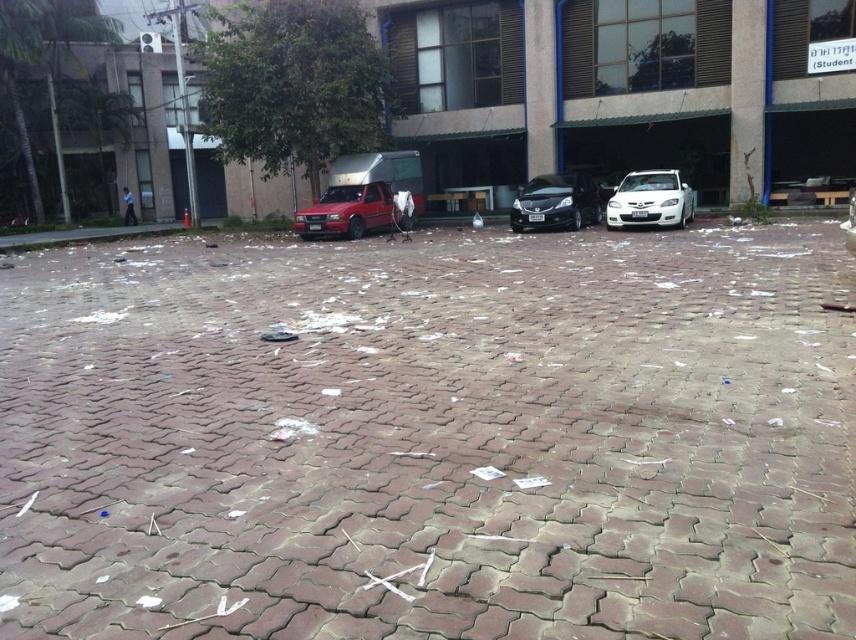
Can you confirm if brick pavement at center is positioned below matte red truck at center?

Indeed, brick pavement at center is positioned under matte red truck at center.

Between brick pavement at center and matte red truck at center, which one has less height?

With less height is matte red truck at center.

Where is `brick pavement at center`? brick pavement at center is located at coordinates (431, 438).

Is satin black car at center thinner than white glossy car at center?

In fact, satin black car at center might be wider than white glossy car at center.

Who is more forward, (x=577, y=220) or (x=669, y=177)?

Point (x=669, y=177)

Which is in front, point (515, 212) or point (639, 186)?

Point (639, 186)

I want to click on satin black car at center, so click(556, 202).

Which of these two, brick pavement at center or satin black car at center, stands taller?

With more height is brick pavement at center.

Locate an element on the screen. This screenshot has height=640, width=856. brick pavement at center is located at coordinates (x=431, y=438).